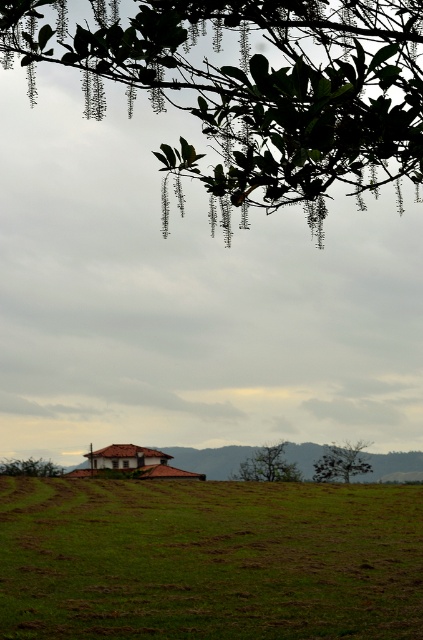
You are a drone operator trying to capture aerial footage of the brown clay house at lower center and the green leafy tree at lower left. Based on the scene, which object would appear closer to the camera in your footage?

The brown clay house at lower center appears closer to the camera because it is positioned in front of the green leafy tree at lower left.

You are a gardener planning to plant a new tree in the field. You want to choose a spot where the new tree will have enough space to grow without immediately blocking the view of the house. Based on the sizes of the existing green leafy tree at lower right and green leafy tree at lower left, which existing tree should you consider as a reference for spacing?

The green leafy tree at lower right has a lesser width compared to the green leafy tree at lower left. Therefore, you should use the green leafy tree at lower left as a reference for spacing since it is wider and would indicate the minimum space needed to avoid blocking the view of the house.